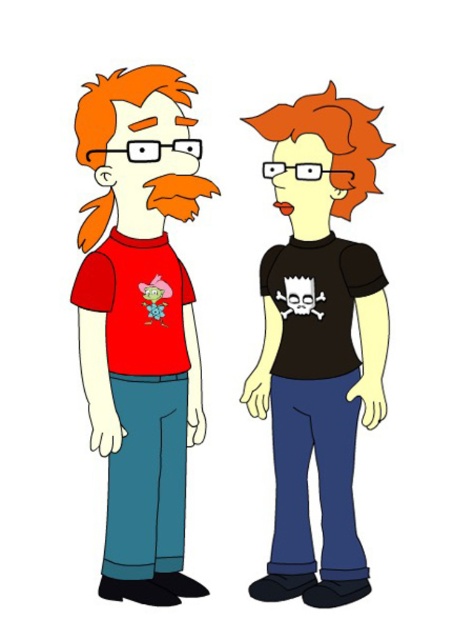
Who is more distant from viewer, [336,445] or [303,298]?

Point [336,445]

The height and width of the screenshot is (640, 453). What do you see at coordinates (318, 342) in the screenshot?
I see `black matte t-shirt at center` at bounding box center [318, 342].

Between point (298, 147) and point (321, 294), which one is positioned in front?

Point (298, 147) is in front.

Find the location of `black matte t-shirt at center`. black matte t-shirt at center is located at coordinates (318, 342).

Is matte red t-shirt at left behind black matte t-shirt at center?

No, it is in front of black matte t-shirt at center.

Based on the photo, can you confirm if matte red t-shirt at left is wider than black matte t-shirt at center?

Incorrect, matte red t-shirt at left's width does not surpass black matte t-shirt at center's.

Where is `matte red t-shirt at left`? matte red t-shirt at left is located at coordinates (139, 326).

Is matte red t-shirt at left to the right of matte black skull at center from the viewer's perspective?

In fact, matte red t-shirt at left is to the left of matte black skull at center.

Is point (179, 179) farther from camera compared to point (280, 308)?

No, it is not.

Does point (164, 568) come closer to viewer compared to point (287, 298)?

That is False.

Find the location of a particular element. Image resolution: width=453 pixels, height=640 pixels. matte red t-shirt at left is located at coordinates (139, 326).